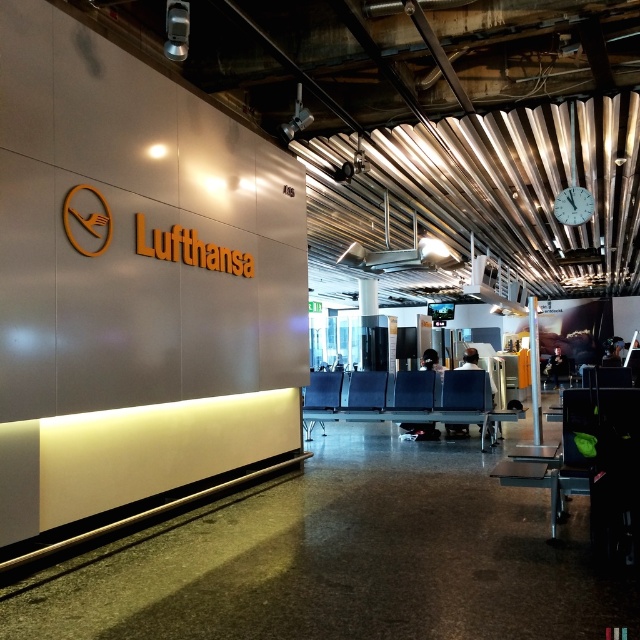
You are a traveler sitting in the airport terminal and need to move your luggage from the black plastic chair at right to the matte blue chair at center. Can you move it directly without moving around any other objects?

The black plastic chair at right is to the right of the matte blue chair at center, so there is a clear path between them. You can move the luggage directly without moving around any other objects.